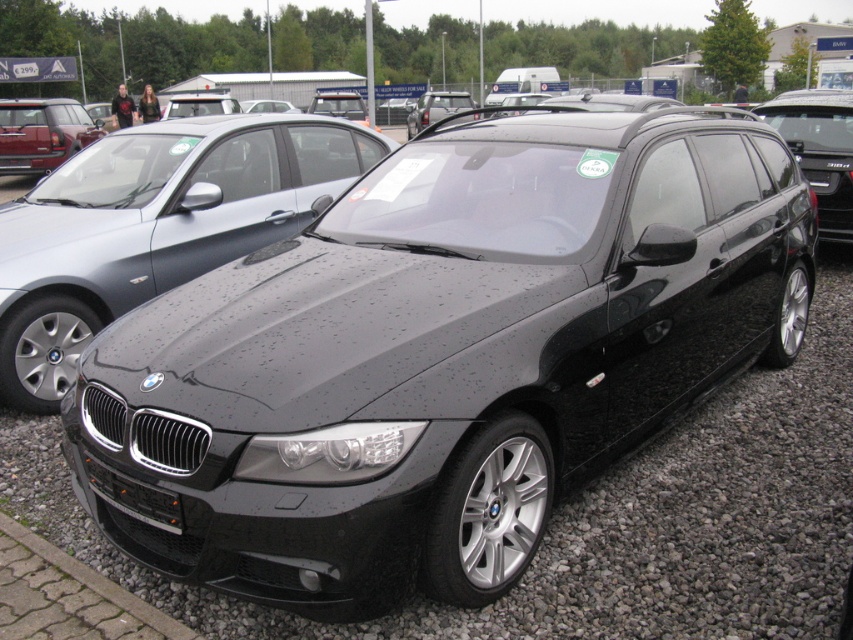
Is black metallic car at center further to camera compared to matte black suv at upper left?

No.

Is black metallic car at center positioned in front of matte black suv at upper left?

Yes, black metallic car at center is in front of matte black suv at upper left.

Describe the element at coordinates (152, 227) in the screenshot. This screenshot has width=853, height=640. I see `black metallic car at center` at that location.

Locate an element on the screen. black metallic car at center is located at coordinates (152, 227).

Which of these two, black metallic car at center or black plastic license plate at front, stands shorter?

With less height is black plastic license plate at front.

Consider the image. Which is below, black metallic car at center or black plastic license plate at front?

Positioned lower is black plastic license plate at front.

Is point (86, 218) closer to camera compared to point (160, 490)?

No.

Where is `black metallic car at center`? black metallic car at center is located at coordinates (152, 227).

Does glossy black car at right have a lesser height compared to matte black suv at upper left?

No, glossy black car at right is not shorter than matte black suv at upper left.

Is glossy black car at right below matte black suv at upper left?

Correct, glossy black car at right is located below matte black suv at upper left.

Identify the location of glossy black car at right. The image size is (853, 640). (819, 148).

Find the location of a particular element. This screenshot has width=853, height=640. glossy black car at right is located at coordinates (819, 148).